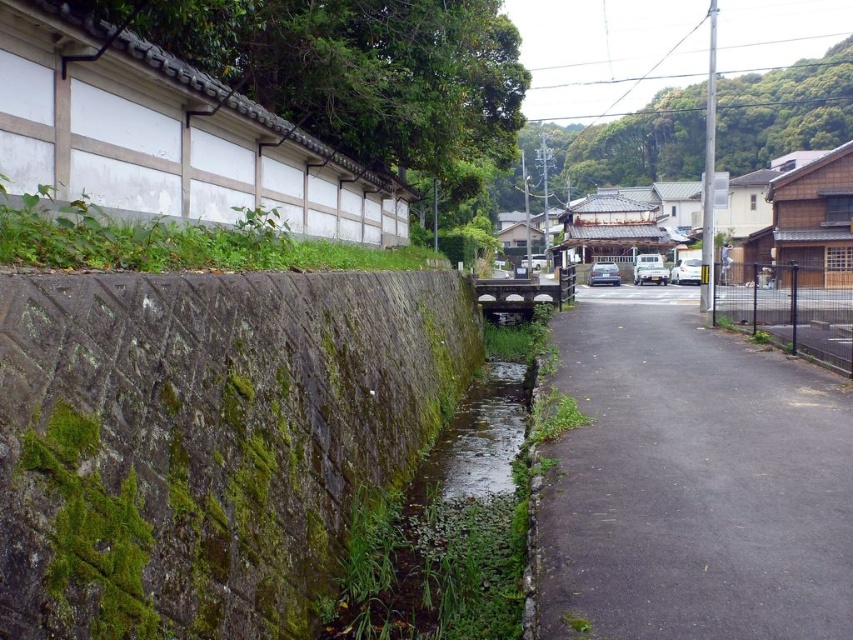
Question: Which point is farther to the camera?

Choices:
 (A) green mossy stone wall at left
 (B) black asphalt path at center

Answer: (B)

Question: Is green mossy stone wall at left positioned at the back of black asphalt path at center?

Choices:
 (A) no
 (B) yes

Answer: (A)

Question: Can you confirm if green mossy stone wall at left is wider than black asphalt path at center?

Choices:
 (A) no
 (B) yes

Answer: (A)

Question: Which point appears farthest from the camera in this image?

Choices:
 (A) (209, 292)
 (B) (670, 436)

Answer: (B)

Question: Which of the following is the farthest from the observer?

Choices:
 (A) black asphalt path at center
 (B) green mossy stone wall at left

Answer: (A)

Question: Does green mossy stone wall at left have a greater width compared to black asphalt path at center?

Choices:
 (A) no
 (B) yes

Answer: (A)